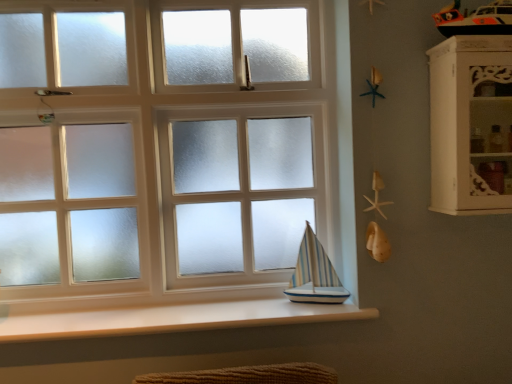
Question: From their relative heights in the image, would you say white frosted glass at center is taller or shorter than white smooth wood at lower center?

Choices:
 (A) short
 (B) tall

Answer: (B)

Question: From the image's perspective, is white frosted glass at center positioned above or below white smooth wood at lower center?

Choices:
 (A) above
 (B) below

Answer: (A)

Question: Estimate the real-world distances between objects in this image. Which object is closer to the white wood cabinet at right?

Choices:
 (A) white frosted glass at center
 (B) white smooth wood at lower center
 (C) blue striped wood sailboat at lower center

Answer: (C)

Question: Estimate the real-world distances between objects in this image. Which object is closer to the white wood cabinet at right?

Choices:
 (A) white smooth wood at lower center
 (B) blue striped wood sailboat at lower center
 (C) white frosted glass at center

Answer: (B)